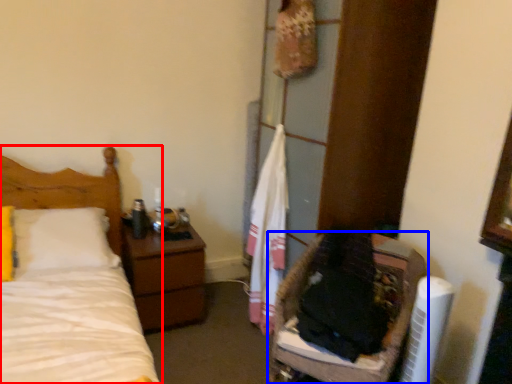
Question: Which point is further to the camera, bed (highlighted by a red box) or furniture (highlighted by a blue box)?

Choices:
 (A) bed
 (B) furniture

Answer: (A)